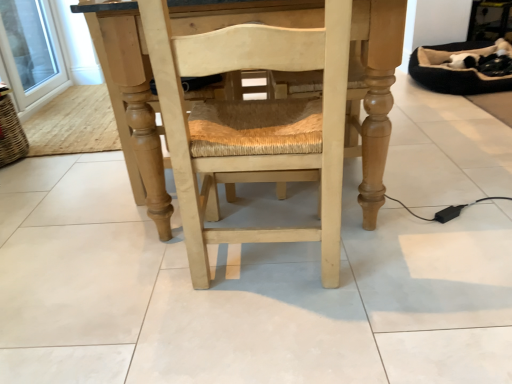
Image resolution: width=512 pixels, height=384 pixels. Find the location of `free space in front of light wood chair at center`. free space in front of light wood chair at center is located at coordinates (289, 342).